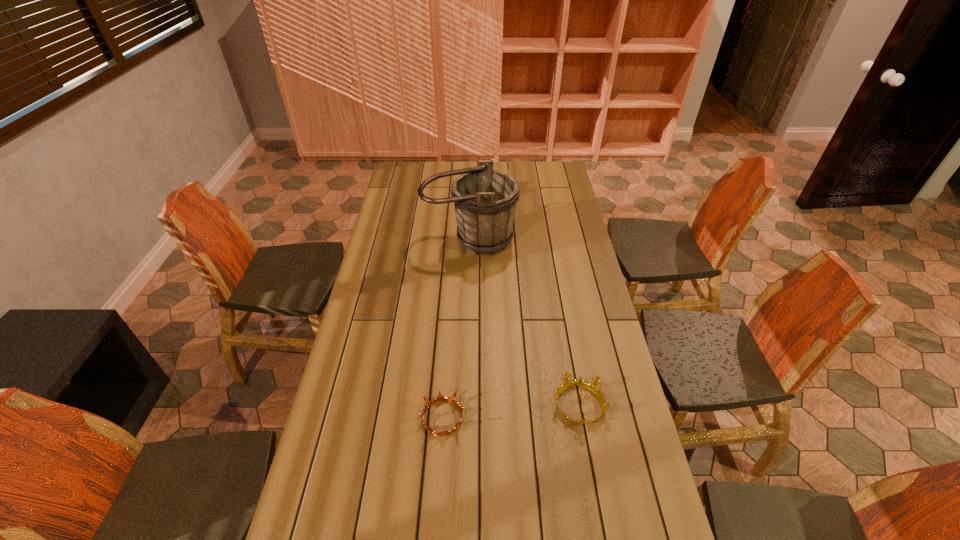
You are a GUI agent. You are given a task and a screenshot of the screen. Output one action in this format:
    pyautogui.click(x=<x>, y=<y>)
    Task: Click on the crown that is the third nearest to the tallest object
    
    Given the screenshot: What is the action you would take?
    pyautogui.click(x=440, y=397)

Identify the location of vacant region that satisfies the following two spatial constraints: 1. on the handle side of the rightmost crown; 2. on the left side of the third nearest object. This screenshot has width=960, height=540. [x=465, y=406].

Where is `vacant region that satisfies the following two spatial constraints: 1. on the back side of the leftmost crown; 2. on the left side of the rightmost crown`? vacant region that satisfies the following two spatial constraints: 1. on the back side of the leftmost crown; 2. on the left side of the rightmost crown is located at coordinates tap(444, 406).

Where is `vacant space that satisfies the following two spatial constraints: 1. on the handle side of the rightmost object; 2. on the left side of the third nearest object`? vacant space that satisfies the following two spatial constraints: 1. on the handle side of the rightmost object; 2. on the left side of the third nearest object is located at coordinates coord(465,406).

The height and width of the screenshot is (540, 960). What are the coordinates of `free spot that satisfies the following two spatial constraints: 1. on the handle side of the third nearest object; 2. on the right side of the rightmost object` in the screenshot? It's located at (465, 406).